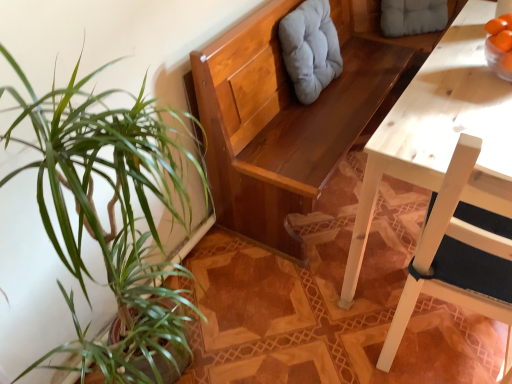
Question: Is light gray fabric cushion at upper center, the first swivel chair when ordered from front to back, oriented towards gray fabric cushion at upper center, the 2th swivel chair positioned from the left?

Choices:
 (A) yes
 (B) no

Answer: (B)

Question: From a real-world perspective, is light gray fabric cushion at upper center, the first swivel chair when ordered from front to back, over gray fabric cushion at upper center, which appears as the first swivel chair when viewed from the back?

Choices:
 (A) yes
 (B) no

Answer: (A)

Question: Considering the relative sizes of light gray fabric cushion at upper center, the second swivel chair from the back, and gray fabric cushion at upper center, the 2th swivel chair positioned from the left, in the image provided, is light gray fabric cushion at upper center, the second swivel chair from the back, wider than gray fabric cushion at upper center, the 2th swivel chair positioned from the left,?

Choices:
 (A) yes
 (B) no

Answer: (B)

Question: From the image's perspective, is light gray fabric cushion at upper center, marked as the 2th swivel chair in a right-to-left arrangement, below gray fabric cushion at upper center, which appears as the first swivel chair when viewed from the back?

Choices:
 (A) yes
 (B) no

Answer: (A)

Question: Is light gray fabric cushion at upper center, the second swivel chair from the back, positioned beyond the bounds of gray fabric cushion at upper center, the 2th swivel chair positioned from the left?

Choices:
 (A) no
 (B) yes

Answer: (B)

Question: From a real-world perspective, is light gray fabric cushion at upper center, the 1th swivel chair in the left-to-right sequence, physically located above or below gray fabric cushion at upper center, the 2th swivel chair positioned from the left?

Choices:
 (A) above
 (B) below

Answer: (A)

Question: In terms of width, does light gray fabric cushion at upper center, the second swivel chair from the back, look wider or thinner when compared to gray fabric cushion at upper center, acting as the first swivel chair starting from the right?

Choices:
 (A) wide
 (B) thin

Answer: (B)

Question: In the image, is light gray fabric cushion at upper center, the 1th swivel chair in the left-to-right sequence, on the left side or the right side of gray fabric cushion at upper center, acting as the first swivel chair starting from the right?

Choices:
 (A) right
 (B) left

Answer: (B)

Question: Is point (291, 54) closer or farther from the camera than point (382, 6)?

Choices:
 (A) farther
 (B) closer

Answer: (B)

Question: Considering the positions of point (398, 1) and point (322, 11), is point (398, 1) closer or farther from the camera than point (322, 11)?

Choices:
 (A) farther
 (B) closer

Answer: (A)

Question: Considering the positions of gray fabric cushion at upper center, acting as the first swivel chair starting from the right, and light gray fabric cushion at upper center, the second swivel chair from the back, in the image, is gray fabric cushion at upper center, acting as the first swivel chair starting from the right, taller or shorter than light gray fabric cushion at upper center, the second swivel chair from the back,?

Choices:
 (A) tall
 (B) short

Answer: (B)

Question: Based on their positions, is gray fabric cushion at upper center, which ranks as the second swivel chair in front-to-back order, located to the left or right of light gray fabric cushion at upper center, the 1th swivel chair in the left-to-right sequence?

Choices:
 (A) right
 (B) left

Answer: (A)

Question: From the image's perspective, is gray fabric cushion at upper center, the 2th swivel chair positioned from the left, above or below light gray fabric cushion at upper center, the second swivel chair from the back?

Choices:
 (A) below
 (B) above

Answer: (B)

Question: In terms of width, does white wood chair at right look wider or thinner when compared to light gray fabric cushion at upper center, the second swivel chair from the back?

Choices:
 (A) thin
 (B) wide

Answer: (B)

Question: Is white wood chair at right inside or outside of light gray fabric cushion at upper center, the 1th swivel chair in the left-to-right sequence?

Choices:
 (A) inside
 (B) outside

Answer: (B)